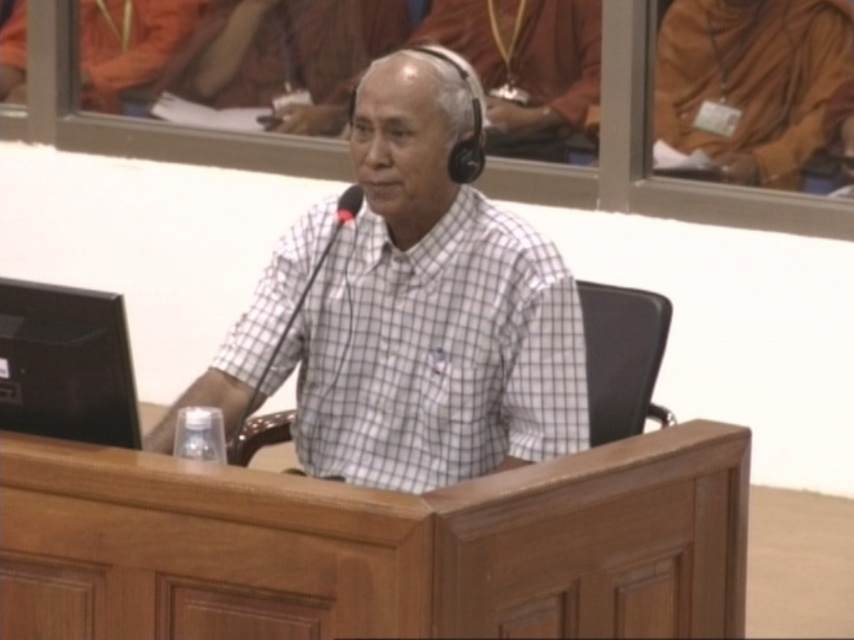
Is brown clothed monk at upper right smaller than black leather chair at center?

Actually, brown clothed monk at upper right might be larger than black leather chair at center.

Between brown clothed monk at upper right and black leather chair at center, which one appears on the left side from the viewer's perspective?

Positioned to the left is black leather chair at center.

This screenshot has height=640, width=854. Find the location of `brown clothed monk at upper right`. brown clothed monk at upper right is located at coordinates (752, 81).

Between brown clothed monk at upper right and black glossy laptop at left, which one is positioned higher?

brown clothed monk at upper right

Between brown clothed monk at upper right and black glossy laptop at left, which one is positioned lower?

black glossy laptop at left

Is point (829, 38) less distant than point (69, 330)?

No, it is not.

The height and width of the screenshot is (640, 854). I want to click on brown clothed monk at upper right, so click(x=752, y=81).

Which is more to the right, white checkered shirt at center or brown clothed monk at upper right?

brown clothed monk at upper right is more to the right.

Between white checkered shirt at center and brown clothed monk at upper right, which one has more height?

white checkered shirt at center

The height and width of the screenshot is (640, 854). Identify the location of white checkered shirt at center. (410, 312).